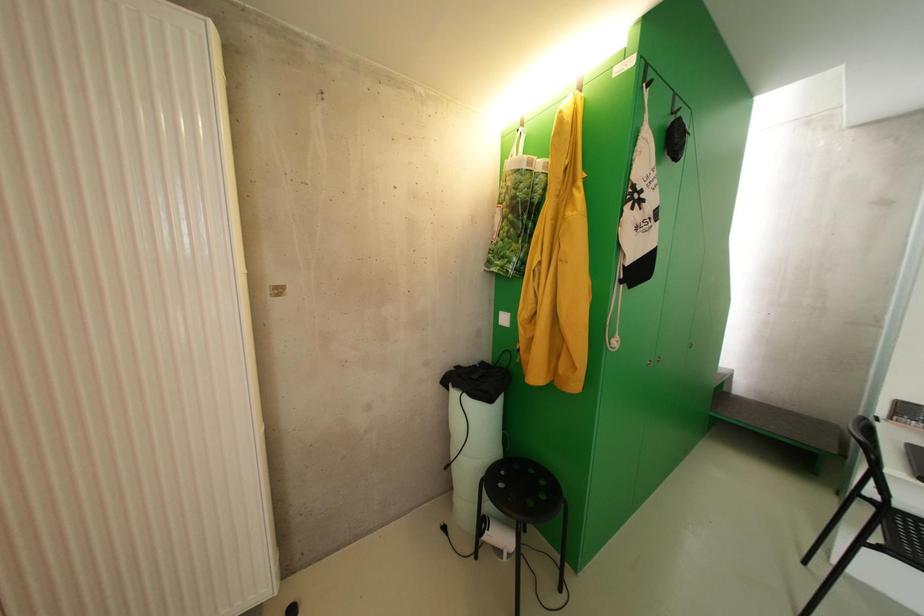
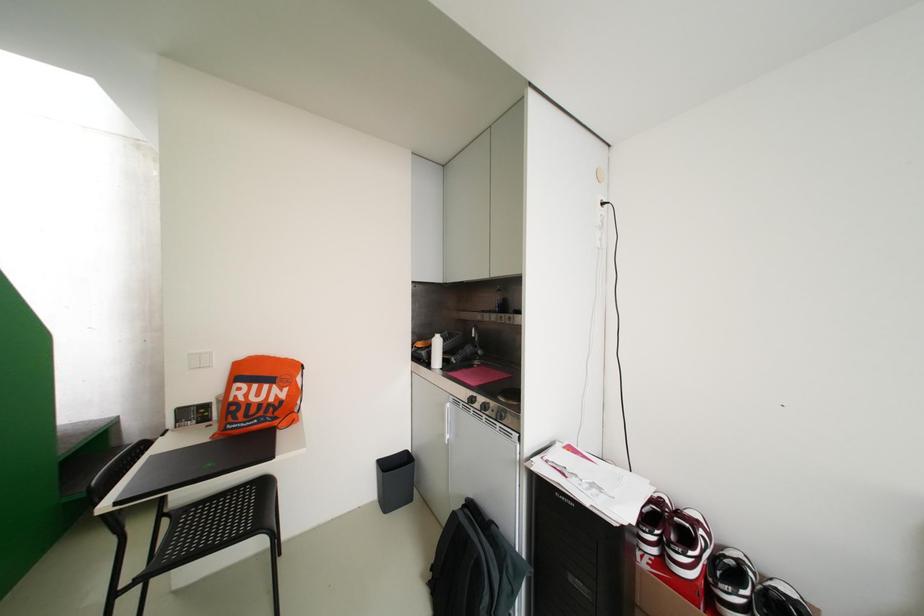
Question: How did the camera likely rotate?

Choices:
 (A) Left
 (B) Right
 (C) Up
 (D) Down

Answer: (B)